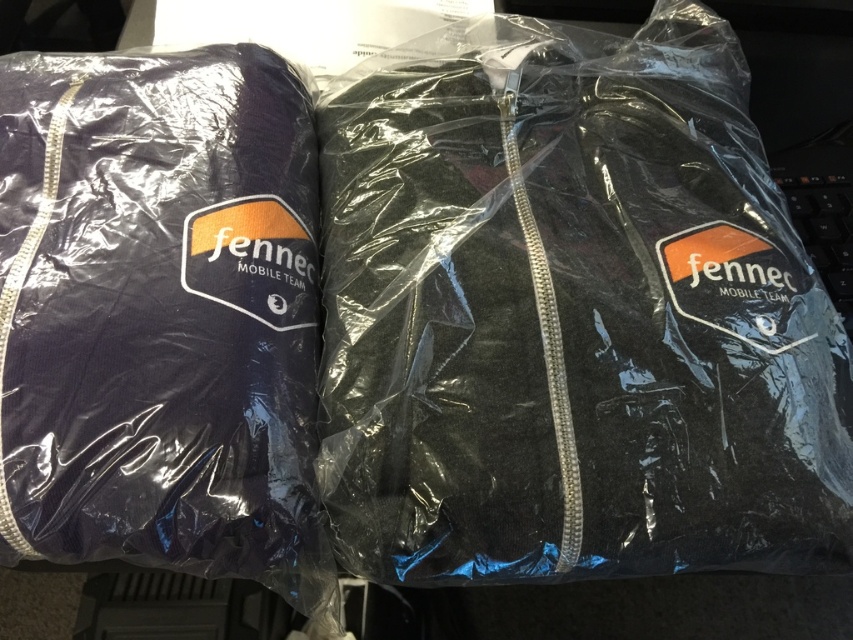
Does matte black jacket at center have a smaller size compared to matte black jacket at left?

Actually, matte black jacket at center might be larger than matte black jacket at left.

Looking at this image, does matte black jacket at center have a lesser height compared to matte black jacket at left?

No, matte black jacket at center is not shorter than matte black jacket at left.

This screenshot has height=640, width=853. Describe the element at coordinates (572, 314) in the screenshot. I see `matte black jacket at center` at that location.

Locate an element on the screen. matte black jacket at center is located at coordinates (572, 314).